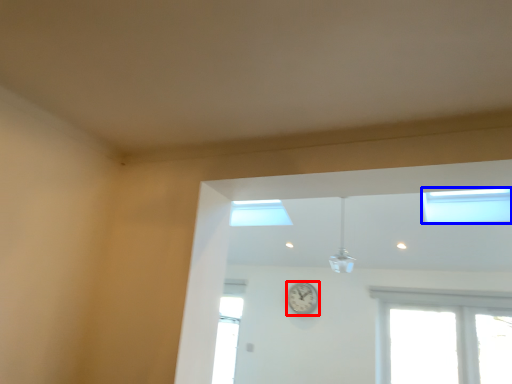
Question: Among these objects, which one is nearest to the camera, clock (highlighted by a red box) or window (highlighted by a blue box)?

Choices:
 (A) clock
 (B) window

Answer: (B)